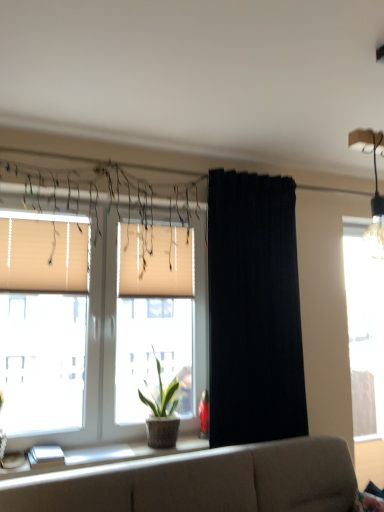
In order to click on blank space situated above beige fabric window at center, the 2th window in the back-to-front sequence (from a real-world perspective) in this screenshot , I will do `click(112, 201)`.